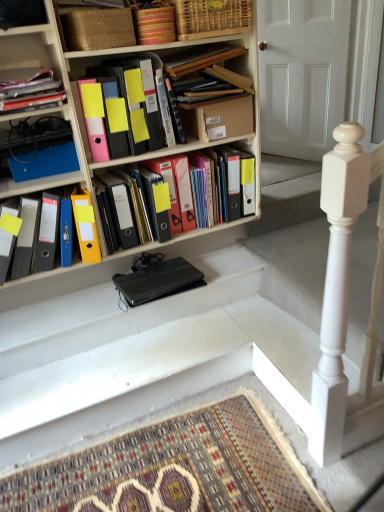
The height and width of the screenshot is (512, 384). I want to click on vacant point to the right of black matte laptop at center, so (x=218, y=267).